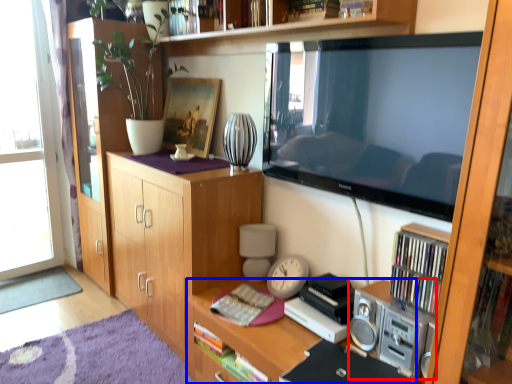
Question: Which point is further to the camera, stereo (highlighted by a red box) or desk (highlighted by a blue box)?

Choices:
 (A) stereo
 (B) desk

Answer: (A)